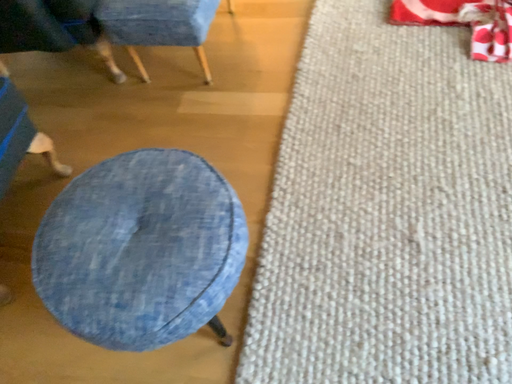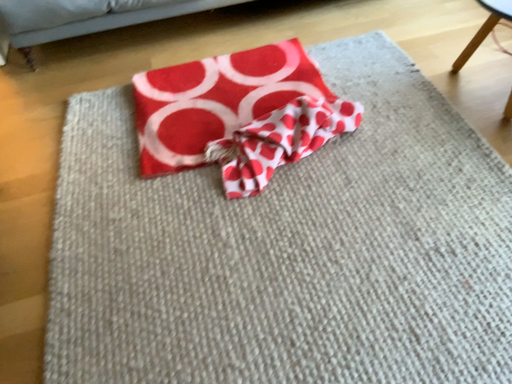
Question: Which way did the camera rotate in the video?

Choices:
 (A) rotated right
 (B) rotated left

Answer: (A)